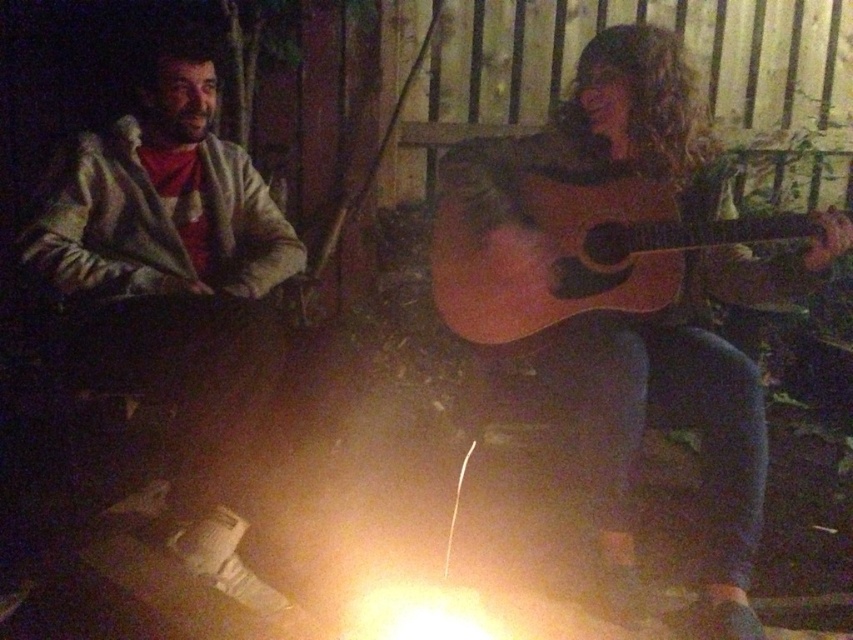
Question: Can you confirm if wooden acoustic guitar at right is positioned above light brown acoustic guitar at right?

Choices:
 (A) no
 (B) yes

Answer: (A)

Question: Among these points, which one is farthest from the camera?

Choices:
 (A) (592, 106)
 (B) (610, 180)

Answer: (A)

Question: Does wooden acoustic guitar at right appear on the right side of light brown acoustic guitar at right?

Choices:
 (A) yes
 (B) no

Answer: (A)

Question: Among these points, which one is farthest from the camera?

Choices:
 (A) (525, 198)
 (B) (598, 540)

Answer: (A)

Question: Which point is farther from the camera taking this photo?

Choices:
 (A) (448, 262)
 (B) (579, 332)

Answer: (A)

Question: Is wooden acoustic guitar at right to the right of light brown acoustic guitar at right from the viewer's perspective?

Choices:
 (A) yes
 (B) no

Answer: (A)